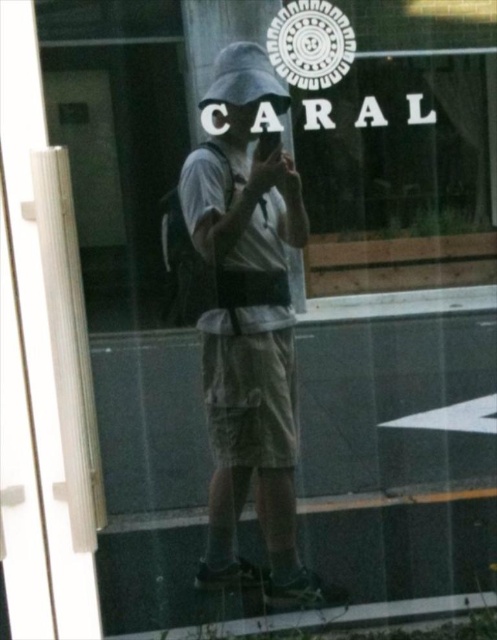
Question: Is khaki cotton shorts at center to the right of dark gray matte baseball hat at upper center from the viewer's perspective?

Choices:
 (A) no
 (B) yes

Answer: (A)

Question: Which of the following is the closest to the observer?

Choices:
 (A) (234, 285)
 (B) (253, 61)

Answer: (B)

Question: Can you confirm if khaki cotton shorts at center is thinner than dark gray matte baseball hat at upper center?

Choices:
 (A) yes
 (B) no

Answer: (B)

Question: Is khaki cotton shorts at center smaller than dark gray matte baseball hat at upper center?

Choices:
 (A) yes
 (B) no

Answer: (B)